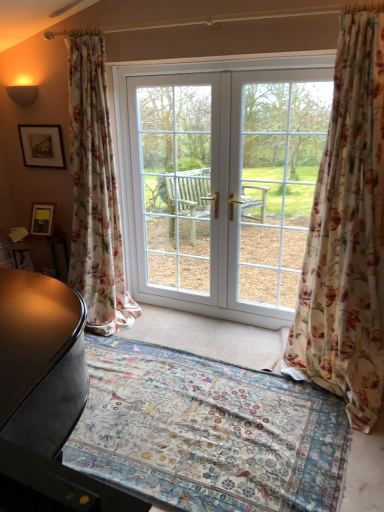
Question: In terms of size, does matte black picture frame at upper left appear bigger or smaller than white glossy door at center?

Choices:
 (A) small
 (B) big

Answer: (A)

Question: Considering their positions, is matte black picture frame at upper left located in front of or behind white glossy door at center?

Choices:
 (A) front
 (B) behind

Answer: (B)

Question: Which is nearer to the white glossy door at center?

Choices:
 (A) floral fabric curtain at left, placed as the 1th curtain when sorted from left to right
 (B) floral fabric curtain at right, arranged as the first curtain when viewed from the right
 (C) matte black picture frame at upper left
 (D) white glass door at center
 (E) floral carpet at center

Answer: (D)

Question: Considering the real-world distances, which object is closest to the white glass door at center?

Choices:
 (A) matte black picture frame at upper left
 (B) floral fabric curtain at left, placed as the 1th curtain when sorted from left to right
 (C) white glossy door at center
 (D) floral carpet at center
 (E) floral fabric curtain at right, which ranks as the second curtain in left-to-right order

Answer: (C)